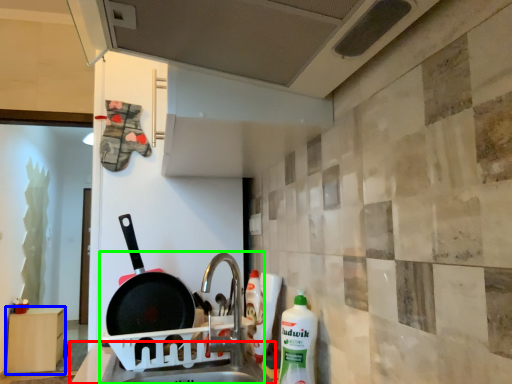
Question: Which object is the farthest from counter top (highlighted by a red box)? Choose among these: furniture (highlighted by a blue box) or sink (highlighted by a green box).

Choices:
 (A) furniture
 (B) sink

Answer: (A)